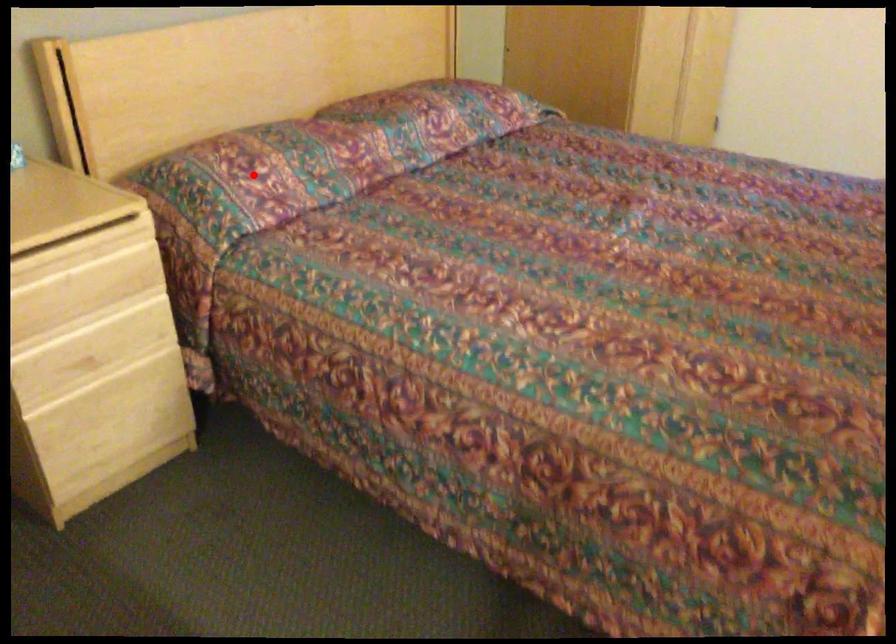
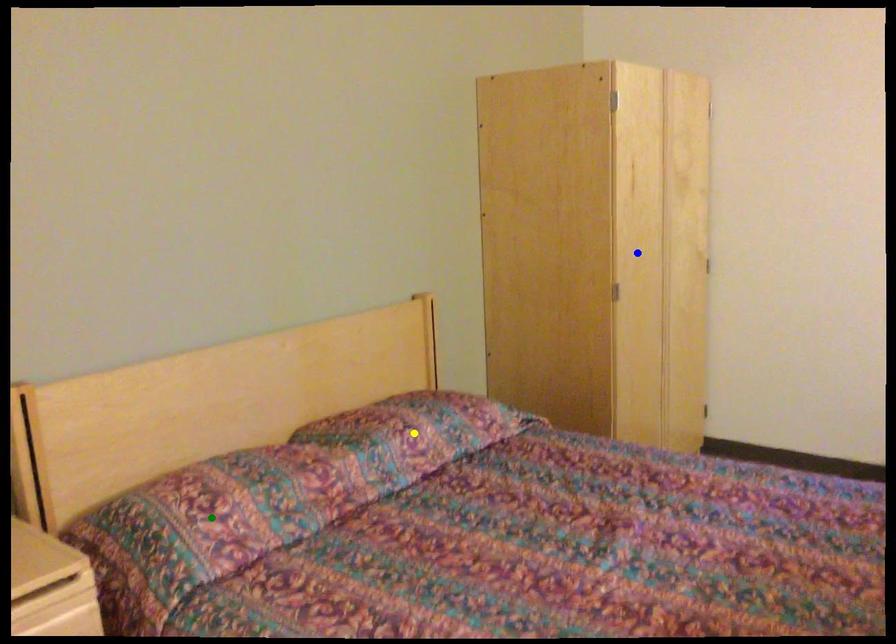
Question: I am providing you with two images of the same scene from different viewpoints. A red point is marked on the first image. You are given multiple points on the second image. Can you choose the point in image 2 that corresponds to the point in image 1?

Choices:
 (A) yellow point
 (B) green point
 (C) blue point

Answer: (B)